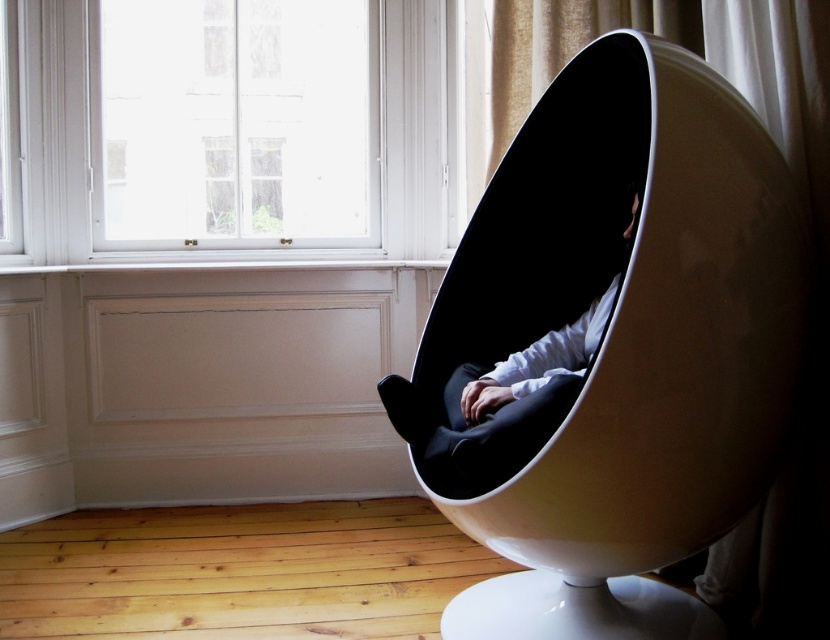
Based on the photo, is the position of matte white egg-shaped chair at right more distant than that of transparent glass window at upper center?

No, it is not.

Can you confirm if matte white egg-shaped chair at right is positioned to the left of transparent glass window at upper center?

Incorrect, matte white egg-shaped chair at right is not on the left side of transparent glass window at upper center.

Is point (579, 173) farther from camera compared to point (282, 134)?

No, (579, 173) is closer to viewer.

Identify the location of matte white egg-shaped chair at right. (614, 348).

Who is taller, matte white egg-shaped chair at right or matte black egg chair at center?

matte white egg-shaped chair at right is taller.

Is matte white egg-shaped chair at right smaller than matte black egg chair at center?

Actually, matte white egg-shaped chair at right might be larger than matte black egg chair at center.

Which is behind, point (755, 392) or point (425, 339)?

The point (425, 339) is more distant.

Where is `matte white egg-shaped chair at right`? This screenshot has height=640, width=830. matte white egg-shaped chair at right is located at coordinates (614, 348).

Looking at this image, can you confirm if transparent glass window at upper center is taller than matte black egg chair at center?

Yes.

Locate an element on the screen. This screenshot has height=640, width=830. transparent glass window at upper center is located at coordinates (233, 122).

Is point (271, 33) farther from viewer compared to point (487, 385)?

Yes, point (271, 33) is farther from viewer.

In order to click on transparent glass window at upper center in this screenshot , I will do `click(233, 122)`.